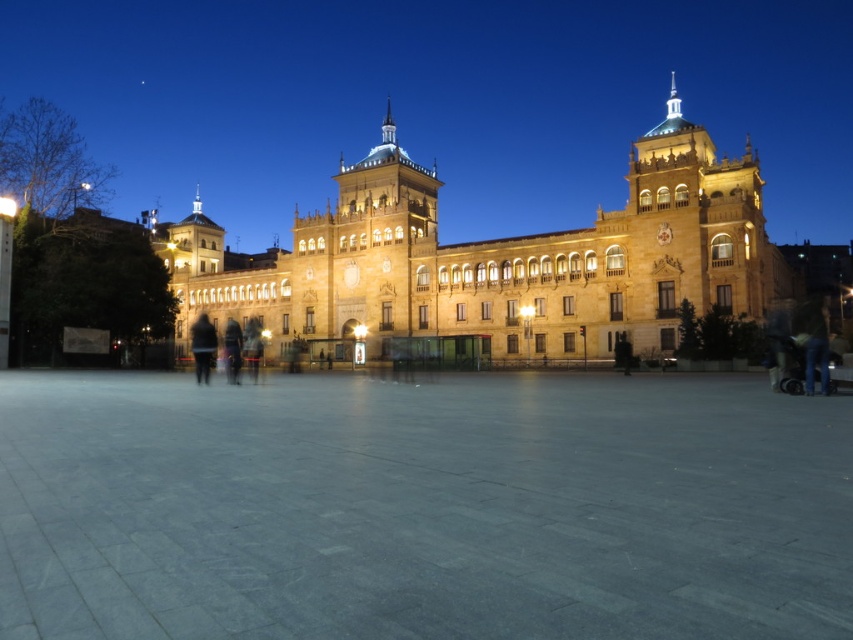
From the picture: You are standing at the point closer to the building in the plaza. There are two points marked in the plaza, one at coordinates point (49, 465) and the other at point (235, 356). Which point is closer to you?

Point (49, 465) is in front of point (235, 356), so it is closer to you.